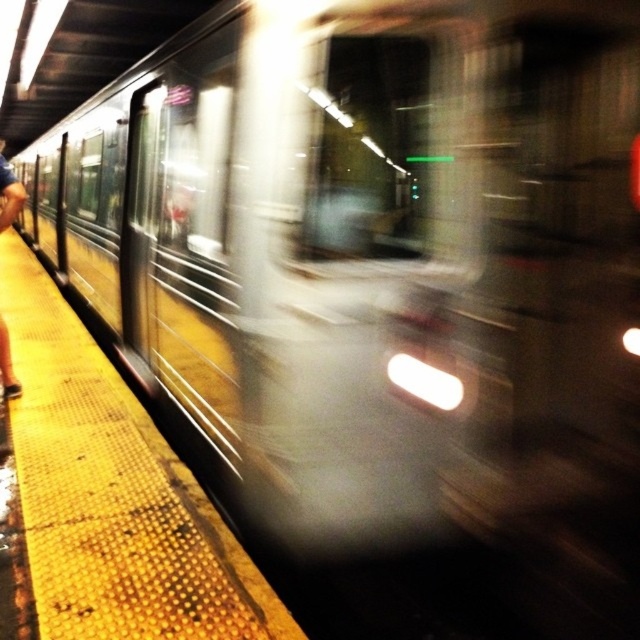
Question: Does yellow textured platform at left have a lesser width compared to blue jeans at left?

Choices:
 (A) yes
 (B) no

Answer: (A)

Question: Is yellow textured platform at left wider than blue jeans at left?

Choices:
 (A) yes
 (B) no

Answer: (B)

Question: Among these points, which one is nearest to the camera?

Choices:
 (A) (106, 435)
 (B) (19, 208)

Answer: (A)

Question: Which point is farther to the camera?

Choices:
 (A) (8, 221)
 (B) (17, 445)

Answer: (A)

Question: Does yellow textured platform at left appear under blue jeans at left?

Choices:
 (A) no
 (B) yes

Answer: (B)

Question: Which point is closer to the camera taking this photo?

Choices:
 (A) (51, 433)
 (B) (1, 211)

Answer: (A)